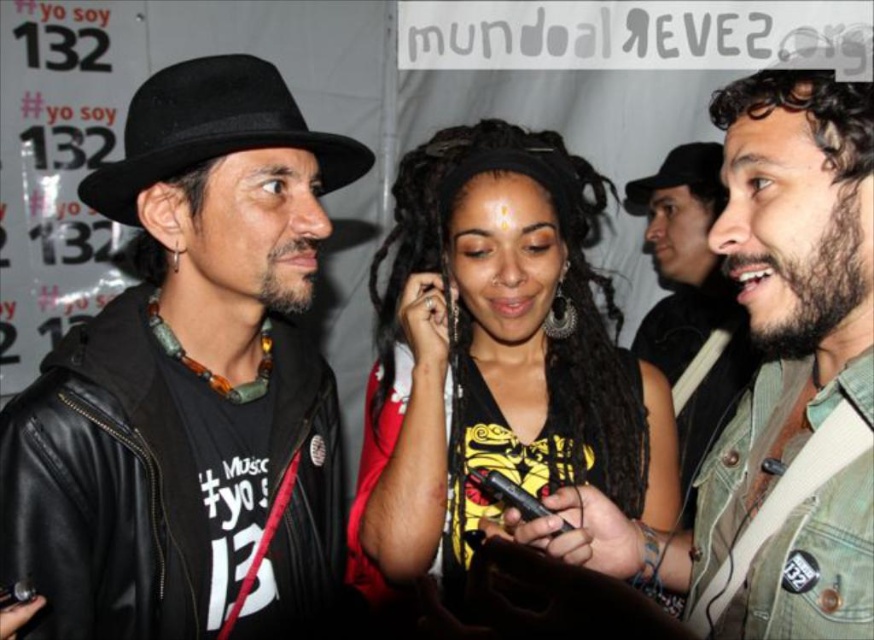
Question: Which point is closer to the camera?

Choices:
 (A) black felt fedora at upper center
 (B) beige denim jacket at center
 (C) black felt fedora at left
 (D) beige textured jacket at right

Answer: (B)

Question: Which object appears closest to the camera in this image?

Choices:
 (A) black leather hat at upper left
 (B) black felt fedora at left
 (C) beige denim jacket at center
 (D) beige textured jacket at right

Answer: (C)

Question: Does beige denim jacket at center come behind black felt fedora at left?

Choices:
 (A) yes
 (B) no

Answer: (B)

Question: Is black matte hair at center wider than black felt fedora at upper center?

Choices:
 (A) yes
 (B) no

Answer: (A)

Question: Does black matte hair at center have a larger size compared to black felt fedora at upper center?

Choices:
 (A) yes
 (B) no

Answer: (A)

Question: Which point is closer to the camera taking this photo?

Choices:
 (A) (336, 467)
 (B) (178, 134)
 (C) (866, 144)
 (D) (484, 221)

Answer: (C)